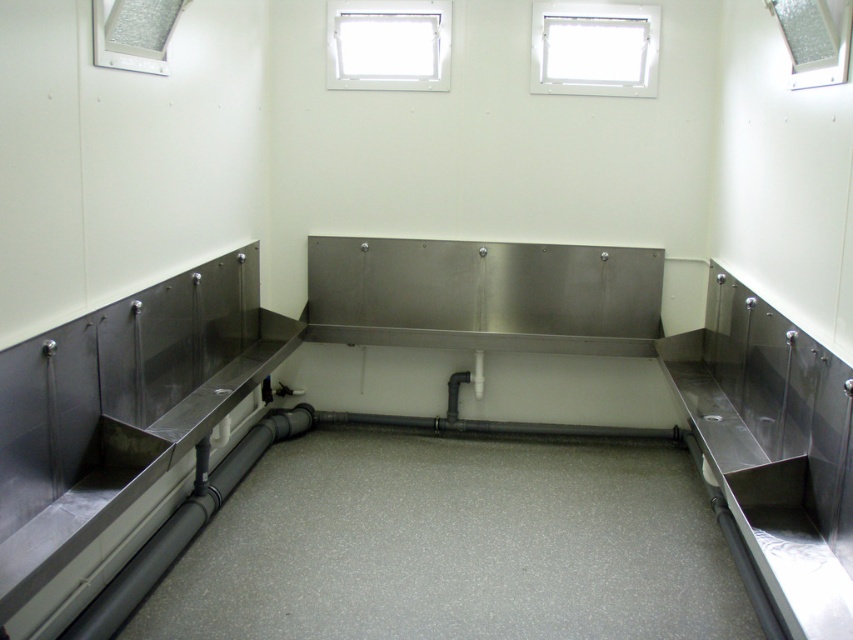
Question: Is white plastic window at upper center positioned before transparent plastic window at upper center?

Choices:
 (A) yes
 (B) no

Answer: (A)

Question: Is transparent plastic window at upper center closer to the viewer compared to clear glass window at upper right?

Choices:
 (A) no
 (B) yes

Answer: (A)

Question: Which object appears closest to the camera in this image?

Choices:
 (A) white plastic window at upper center
 (B) clear glass window at upper right
 (C) transparent plastic window at upper center
 (D) clear glass window at upper left

Answer: (B)

Question: Can you confirm if transparent plastic window at upper center is positioned to the right of clear glass window at upper right?

Choices:
 (A) yes
 (B) no

Answer: (B)

Question: Which object appears farthest from the camera in this image?

Choices:
 (A) clear glass window at upper left
 (B) transparent plastic window at upper center
 (C) clear glass window at upper right

Answer: (B)

Question: Considering the real-world distances, which object is closest to the transparent plastic window at upper center?

Choices:
 (A) clear glass window at upper left
 (B) white plastic window at upper center
 (C) clear glass window at upper right

Answer: (B)